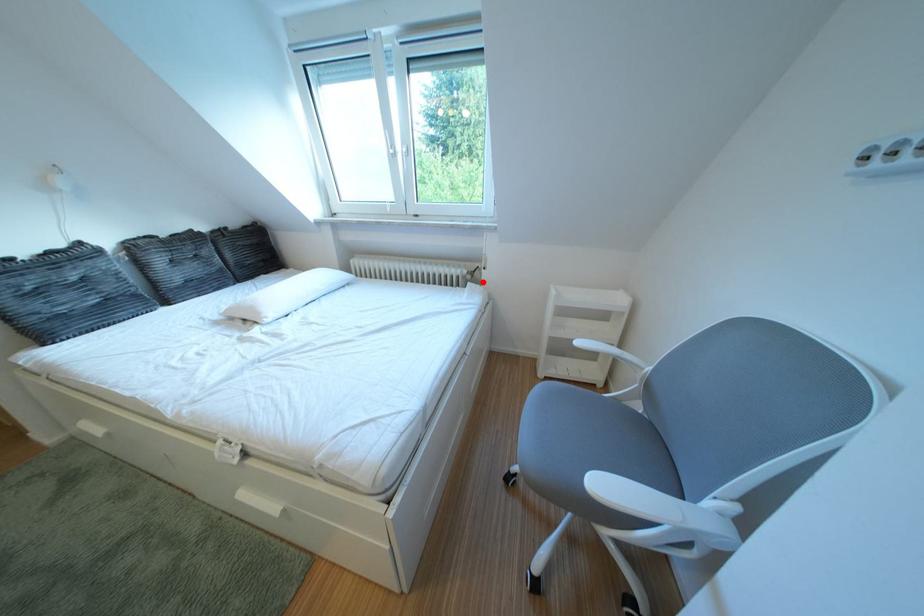
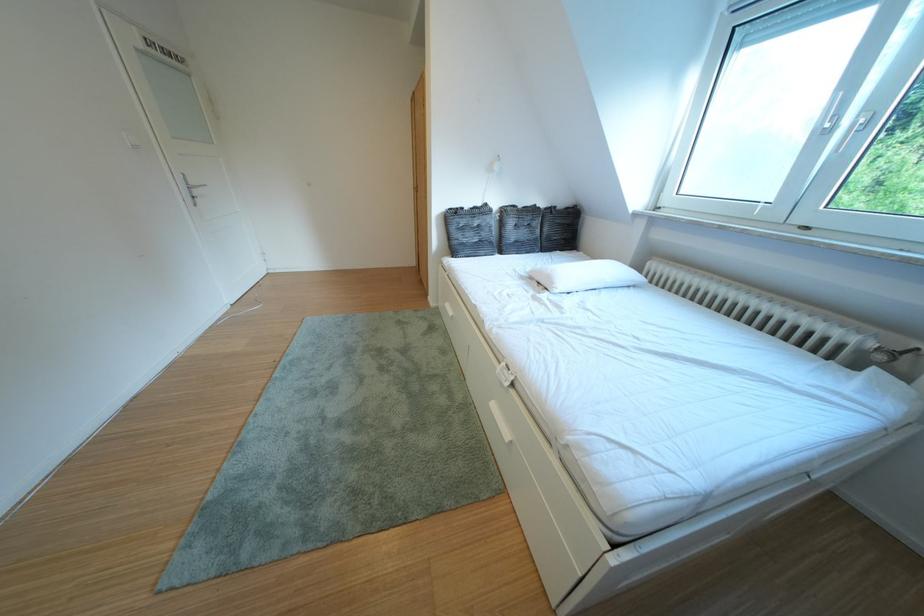
The point at the highlighted location is marked in the first image. Where is the corresponding point in the second image?

(893, 363)